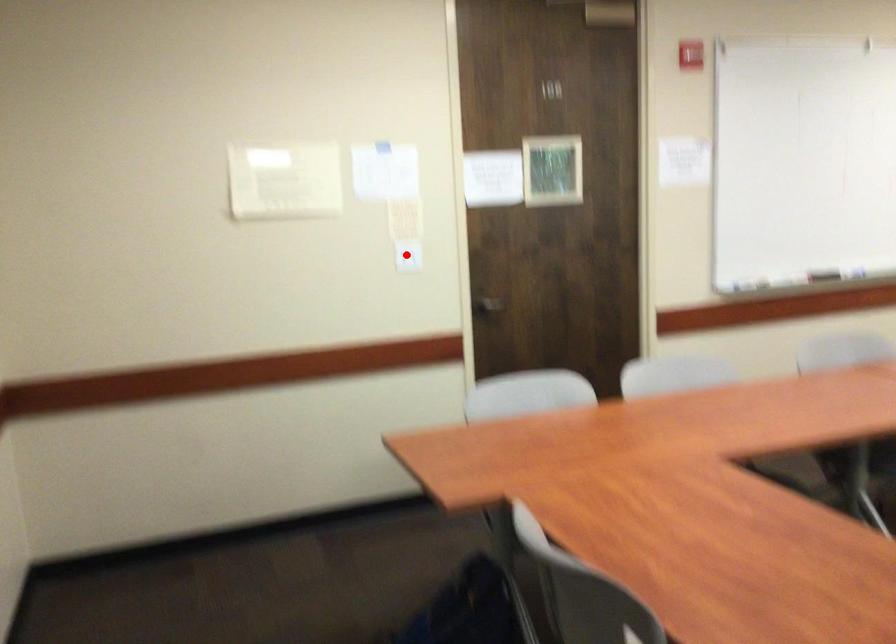
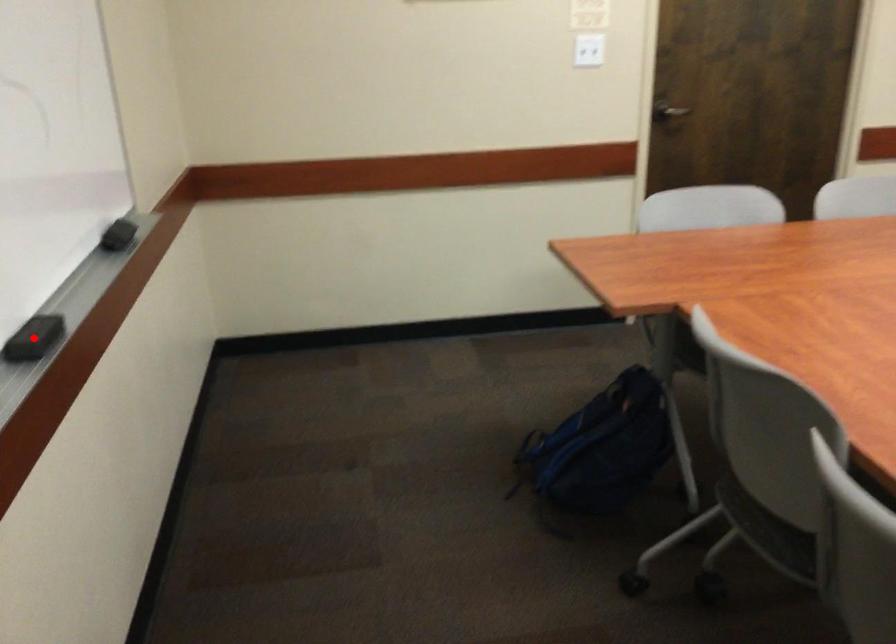
I am providing you with two images of the same scene from different viewpoints. A red point is marked on the first image and another point is marked on the second image. Does the point marked in image1 correspond to the same location as the one in image2?

No